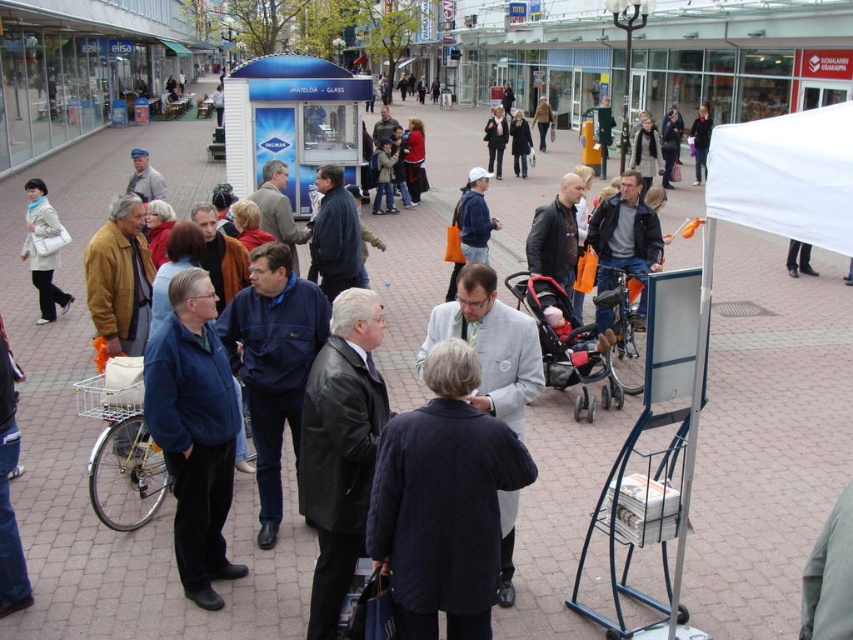
This screenshot has height=640, width=853. What do you see at coordinates (273, 364) in the screenshot?
I see `navy blue jacket at center` at bounding box center [273, 364].

This screenshot has width=853, height=640. What do you see at coordinates (273, 364) in the screenshot? I see `navy blue jacket at center` at bounding box center [273, 364].

What are the coordinates of `navy blue jacket at center` in the screenshot? It's located at (273, 364).

Who is positioned more to the left, white fabric canopy at upper right or dark blue jacket at upper right?

From the viewer's perspective, white fabric canopy at upper right appears more on the left side.

Which is behind, point (730, 136) or point (709, 138)?

The point (709, 138) is more distant.

Which is in front, point (817, 163) or point (691, 125)?

Point (817, 163) is more forward.

Locate an element on the screen. white fabric canopy at upper right is located at coordinates (786, 176).

Is point (152, 177) farther from camera compared to point (698, 138)?

No, (152, 177) is closer to viewer.

Is point (146, 163) closer to camera compared to point (699, 150)?

Yes, it is.

Does point (152, 170) come in front of point (701, 163)?

Yes, it is in front of point (701, 163).

Where is `light blue fabric jacket at center`? Image resolution: width=853 pixels, height=640 pixels. light blue fabric jacket at center is located at coordinates (144, 177).